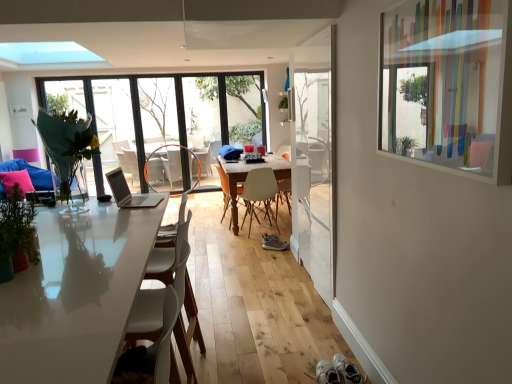
What are the coordinates of `tan suede sneaker at center` in the screenshot? It's located at (273, 243).

The image size is (512, 384). Identify the location of green matte plant at center, the second plant in the front-to-back sequence. (283, 104).

In the image, is translucent plastic window screen at upper right positioned in front of or behind wooden round table at center?

Visually, translucent plastic window screen at upper right is located in front of wooden round table at center.

Is translucent plastic window screen at upper right with wooden round table at center?

No, translucent plastic window screen at upper right is not in contact with wooden round table at center.

Would you say translucent plastic window screen at upper right is inside or outside wooden round table at center?

translucent plastic window screen at upper right is located beyond the bounds of wooden round table at center.

From a real-world perspective, relative to wooden round table at center, is translucent plastic window screen at upper right vertically above or below?

translucent plastic window screen at upper right is situated higher than wooden round table at center in the real world.

Between wooden round table at center and green matte plant at center, which is the 1th plant from back to front, which one has smaller size?

With smaller size is green matte plant at center, which is the 1th plant from back to front.

Are wooden round table at center and green matte plant at center, which is the 1th plant from back to front, far apart?

Indeed, wooden round table at center is not near green matte plant at center, which is the 1th plant from back to front.

Is point (273, 155) in front of point (286, 106)?

No, (273, 155) is behind (286, 106).

From a real-world perspective, between wooden round table at center and green matte plant at center, the 2th plant viewed from the left, who is vertically lower?

In real-world perspective, wooden round table at center is lower.

From a real-world perspective, relative to green matte plant at center, which is counted as the 1th plant, starting from the right, is matte glass door at center vertically above or below?

In terms of real-world spatial position, matte glass door at center is below green matte plant at center, which is counted as the 1th plant, starting from the right.

From the image's perspective, between matte glass door at center and green matte plant at center, the 2th plant positioned from the bottom, which one is located above?

green matte plant at center, the 2th plant positioned from the bottom, appears higher in the image.

Considering the relative sizes of matte glass door at center and green matte plant at center, the second plant in the front-to-back sequence, in the image provided, is matte glass door at center shorter than green matte plant at center, the second plant in the front-to-back sequence,?

No.

Looking at this image, how much distance is there between tan suede sneaker at center and green matte plant at center, the second plant in the front-to-back sequence?

tan suede sneaker at center and green matte plant at center, the second plant in the front-to-back sequence, are 5.65 feet apart.

Is tan suede sneaker at center thinner than green matte plant at center, which is the 1th plant from top to bottom?

In fact, tan suede sneaker at center might be wider than green matte plant at center, which is the 1th plant from top to bottom.

Is tan suede sneaker at center positioned with its back to green matte plant at center, which is the 1th plant from top to bottom?

That's not correct — tan suede sneaker at center is not looking away from green matte plant at center, which is the 1th plant from top to bottom.

From the image's perspective, is tan suede sneaker at center under green matte plant at center, which is the 1th plant from back to front?

Yes.

In the scene shown: Can you confirm if green matte plant at center, which is counted as the 1th plant, starting from the right, is taller than wooden round table at center?

Incorrect, the height of green matte plant at center, which is counted as the 1th plant, starting from the right, is not larger of that of wooden round table at center.

Considering the positions of objects green matte plant at center, the second plant in the front-to-back sequence, and wooden round table at center in the image provided, who is behind, green matte plant at center, the second plant in the front-to-back sequence, or wooden round table at center?

green matte plant at center, the second plant in the front-to-back sequence, is further away from the camera.

Which of these two, green matte plant at center, which is the 1th plant from top to bottom, or wooden round table at center, is bigger?

Bigger between the two is wooden round table at center.

Can you tell me how much green matte plant at center, the 2th plant viewed from the left, and wooden round table at center differ in facing direction?

89.4 degrees separate the facing orientations of green matte plant at center, the 2th plant viewed from the left, and wooden round table at center.

Who is smaller, transparent glass screen door at center or matte orange armchair at center?

matte orange armchair at center.

Considering the sizes of objects transparent glass screen door at center and matte orange armchair at center in the image provided, who is taller, transparent glass screen door at center or matte orange armchair at center?

With more height is transparent glass screen door at center.

From the image's perspective, is transparent glass screen door at center over matte orange armchair at center?

No, from the image's perspective, transparent glass screen door at center is not over matte orange armchair at center.

Is matte orange armchair at center located within transparent glass screen door at center?

No, matte orange armchair at center is not surrounded by transparent glass screen door at center.

Can you confirm if transparent glass window at upper center is shorter than white plastic chair at center, the 3th chair when ordered from back to front?

No.

Consider the image. Who is smaller, transparent glass window at upper center or white plastic chair at center, positioned as the first chair in front-to-back order?

white plastic chair at center, positioned as the first chair in front-to-back order.

Consider the image. Considering the positions of objects transparent glass window at upper center and white plastic chair at center, positioned as the first chair in front-to-back order, in the image provided, who is more to the right, transparent glass window at upper center or white plastic chair at center, positioned as the first chair in front-to-back order,?

white plastic chair at center, positioned as the first chair in front-to-back order, is more to the right.

Is transparent glass window at upper center positioned far away from white plastic chair at center, positioned as the first chair in front-to-back order?

Yes.

Identify the location of window screen that is above the wooden round table at center (from the image's perspective). (448, 84).

In the image, there is a green matte plant at center, the 2th plant positioned from the bottom. Identify the location of round table below it (from the image's perspective). (246, 176).

From the image, which object appears to be farther from wooden round table at center, white plastic chair at center, positioned as the first chair in front-to-back order, or beige plastic chair at center, the 2th chair positioned from the front?

white plastic chair at center, positioned as the first chair in front-to-back order.

Estimate the real-world distances between objects in this image. Which object is closer to wooden round table at center, transparent glass window at upper center or matte orange armchair at center?

transparent glass window at upper center.

When comparing their distances from matte orange armchair at center, does tan suede sneaker at center or matte glass door at center seem further?

Based on the image, tan suede sneaker at center appears to be further to matte orange armchair at center.

Which object lies nearer to the anchor point matte glass door at center, green matte plant at center, which is the 1th plant from top to bottom, or translucent plastic window screen at upper right?

Among the two, green matte plant at center, which is the 1th plant from top to bottom, is located nearer to matte glass door at center.

Consider the image. Considering their positions, is orange wood chair at center, positioned as the 1th chair in back-to-front order, positioned further to wooden round table at center than green matte plant at left, the first plant from the left?

The object further to wooden round table at center is green matte plant at left, the first plant from the left.

Estimate the real-world distances between objects in this image. Which object is closer to tan suede sneaker at center, transparent glass window at upper center or wooden round table at center?

The object closer to tan suede sneaker at center is wooden round table at center.

Which object lies nearer to the anchor point tan suede sneaker at center, green matte plant at center, which is counted as the 1th plant, starting from the right, or matte glass door at center?

Based on the image, green matte plant at center, which is counted as the 1th plant, starting from the right, appears to be nearer to tan suede sneaker at center.

Based on their spatial positions, is matte glass door at center or green matte plant at left, the 2th plant in the right-to-left sequence, further from translucent plastic window screen at upper right?

matte glass door at center.

At what (x,y) coordinates should I click in order to perform the action: click on chair between green matte plant at left, the first plant from the left, and tan suede sneaker at center from front to back. Please return your answer as a coordinate pair (x, y). The width and height of the screenshot is (512, 384). Looking at the image, I should click on (146, 316).

At what (x,y) coordinates should I click in order to perform the action: click on shoe between white plastic chair at center, positioned as the first chair in front-to-back order, and orange wood chair at center, positioned as the 1th chair in back-to-front order, from front to back. Please return your answer as a coordinate pair (x, y). Looking at the image, I should click on (273, 243).

The width and height of the screenshot is (512, 384). Find the location of `round table between tan suede sneaker at center and orange wood chair at center, acting as the 3th chair starting from the front, in the front-back direction`. round table between tan suede sneaker at center and orange wood chair at center, acting as the 3th chair starting from the front, in the front-back direction is located at coordinates click(x=246, y=176).

I want to click on chair between wooden round table at center and transparent glass window at upper center in the front-back direction, so click(224, 187).